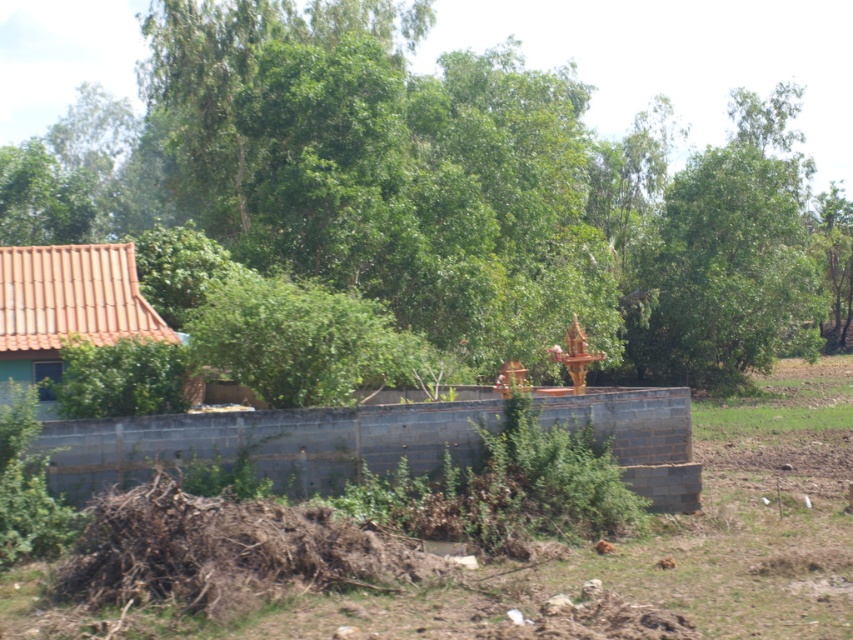
Is the position of green leafy tree at center less distant than that of brown soil at lower center?

No, green leafy tree at center is behind brown soil at lower center.

Can you confirm if green leafy tree at center is wider than brown soil at lower center?

Yes, green leafy tree at center is wider than brown soil at lower center.

This screenshot has height=640, width=853. Describe the element at coordinates (457, 192) in the screenshot. I see `green leafy tree at center` at that location.

This screenshot has height=640, width=853. Find the location of `green leafy tree at center`. green leafy tree at center is located at coordinates (457, 192).

Can you confirm if green leafy tree at center is thinner than orange clay roof at left?

In fact, green leafy tree at center might be wider than orange clay roof at left.

Is green leafy tree at center positioned before orange clay roof at left?

No, it is behind orange clay roof at left.

Is point (583, 220) positioned after point (39, 353)?

Yes, it is behind point (39, 353).

In order to click on green leafy tree at center in this screenshot , I will do `click(457, 192)`.

Does point (752, 420) lie behind point (65, 300)?

Yes.

Does brown soil at lower center have a lesser width compared to orange clay roof at left?

Incorrect, brown soil at lower center's width is not less than orange clay roof at left's.

Between point (788, 449) and point (91, 275), which one is positioned behind?

Point (788, 449)

You are a GUI agent. You are given a task and a screenshot of the screen. Output one action in this format:
    pyautogui.click(x=<x>, y=<y>)
    Task: Click on the brown soil at lower center
    
    Given the screenshot: What is the action you would take?
    pyautogui.click(x=653, y=541)